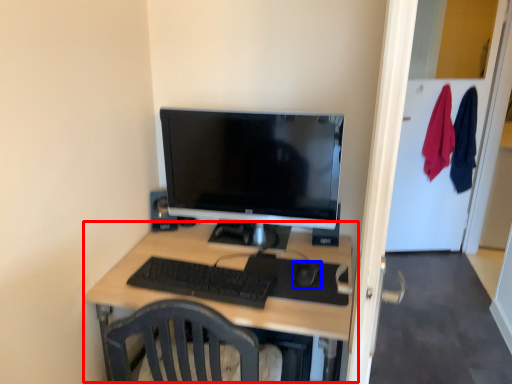
Question: Which point is further to the camera, desk (highlighted by a red box) or mouse (highlighted by a blue box)?

Choices:
 (A) desk
 (B) mouse

Answer: (B)